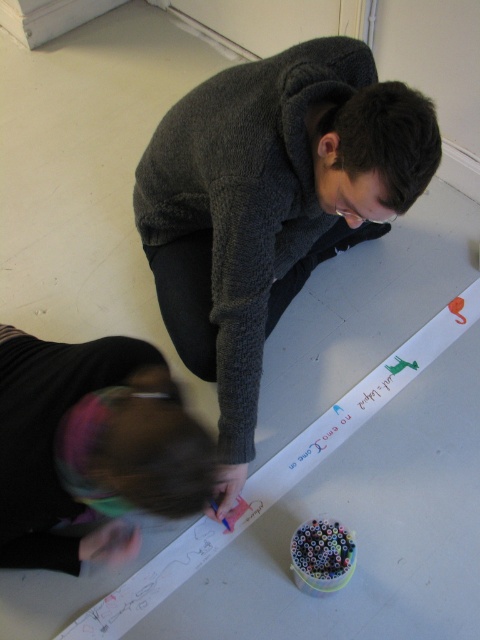
Question: Can you confirm if dark gray sweater at upper center is positioned above black hair at lower left?

Choices:
 (A) no
 (B) yes

Answer: (B)

Question: Which point is farther from the camera taking this photo?

Choices:
 (A) (126, 364)
 (B) (244, 369)

Answer: (B)

Question: In this image, where is dark gray sweater at upper center located relative to black hair at lower left?

Choices:
 (A) right
 (B) left

Answer: (A)

Question: Does dark gray sweater at upper center lie in front of black hair at lower left?

Choices:
 (A) yes
 (B) no

Answer: (B)

Question: Which point is closer to the camera?

Choices:
 (A) black hair at lower left
 (B) dark gray sweater at upper center

Answer: (A)